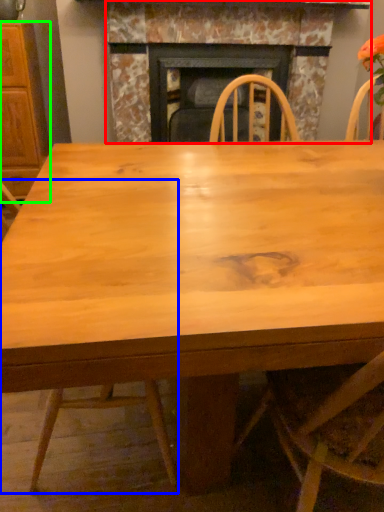
Question: Based on their relative distances, which object is farther from fireplace (highlighted by a red box)? Choose from chair (highlighted by a blue box) and cabinetry (highlighted by a green box).

Choices:
 (A) chair
 (B) cabinetry

Answer: (A)